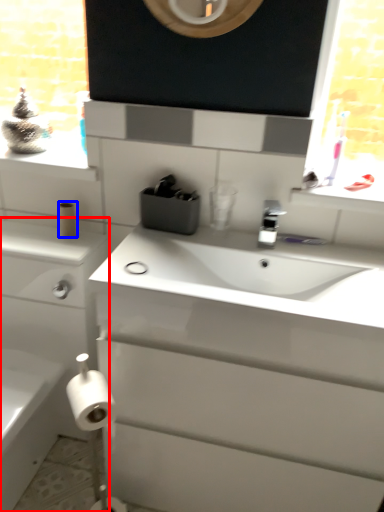
Question: Among these objects, which one is nearest to the camera, bathroom cabinet (highlighted by a red box) or toilet paper (highlighted by a blue box)?

Choices:
 (A) bathroom cabinet
 (B) toilet paper

Answer: (A)